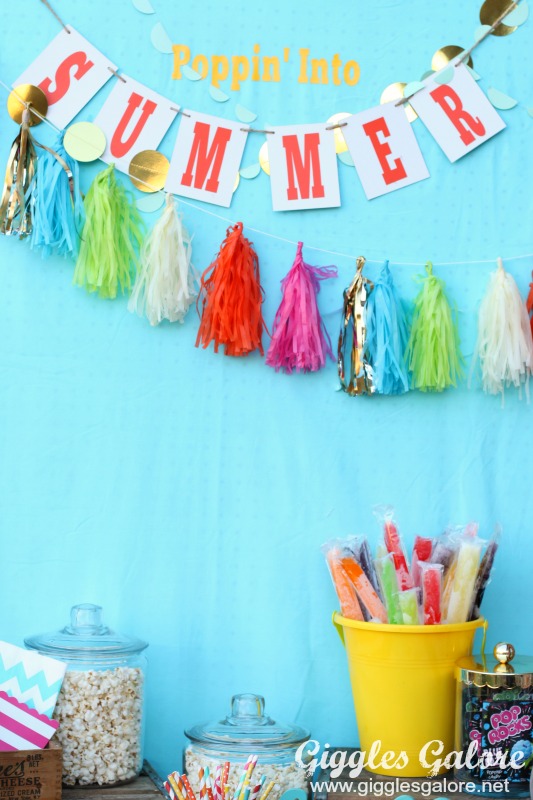
Locate an element on the screen. The height and width of the screenshot is (800, 533). woodsurface is located at coordinates (141, 782).